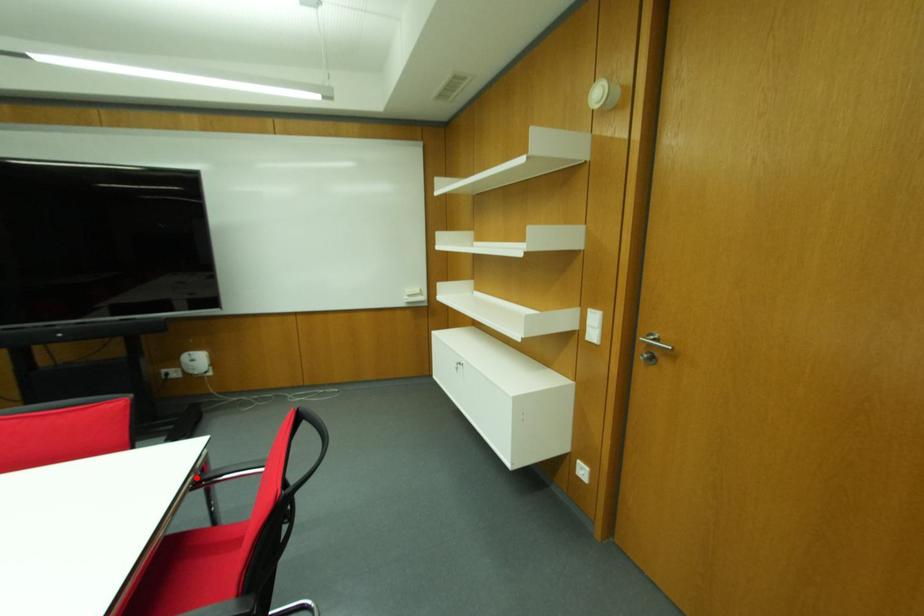
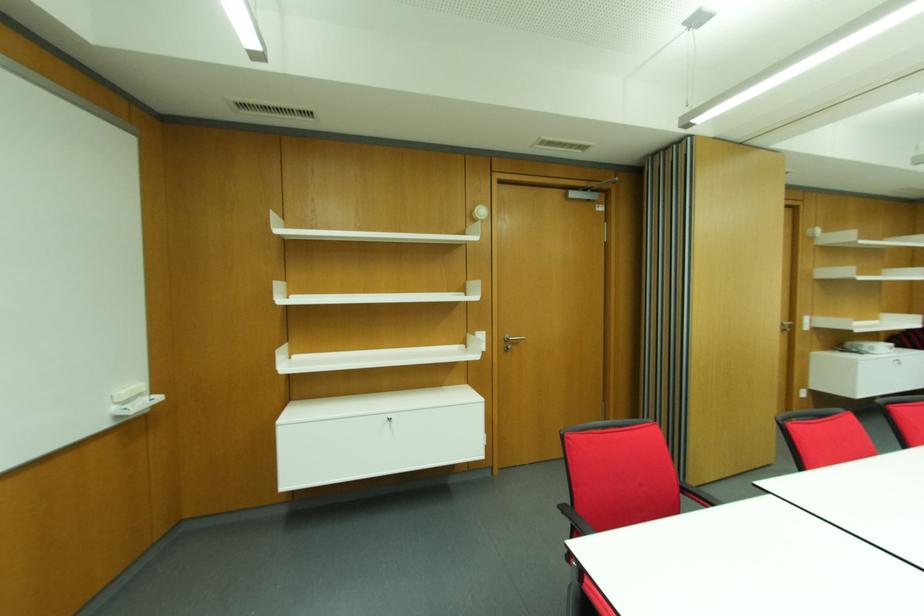
Question: I am providing you with two images of the same scene from different viewpoints. A red point is marked on the first image. At the location where the point appears in image 1, is it still visible in image 2?

Choices:
 (A) Yes
 (B) No

Answer: (B)